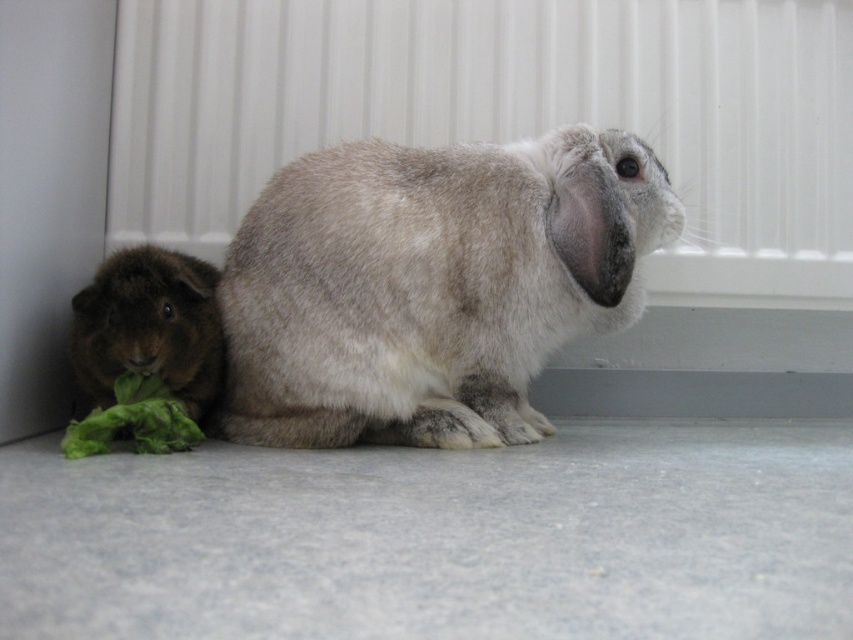
You are a pet owner trying to clean the cage. You need to move the brown fuzzy guinea pig at lower left and the fuzzy gray rabbit at center to a holding area. Which animal should you move first to avoid blocking access to the other?

The brown fuzzy guinea pig at lower left is behind the fuzzy gray rabbit at center. Therefore, you should move the fuzzy gray rabbit at center first to avoid blocking access to the brown fuzzy guinea pig at lower left.